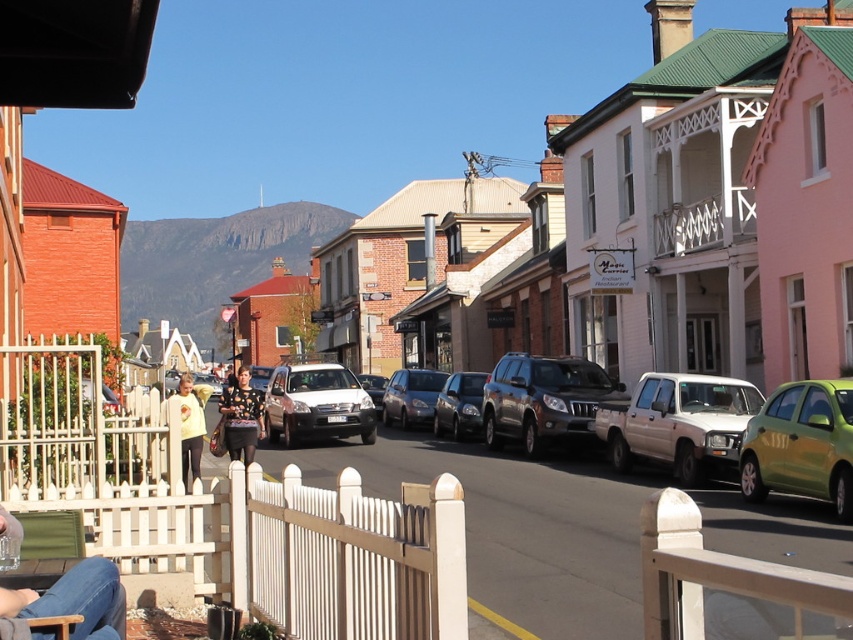
Between white matte truck at center and yellow matte shirt at lower left, which one appears on the left side from the viewer's perspective?

Positioned to the left is yellow matte shirt at lower left.

Can you confirm if white matte truck at center is positioned below yellow matte shirt at lower left?

No.

Describe the element at coordinates (679, 422) in the screenshot. This screenshot has height=640, width=853. I see `white matte truck at center` at that location.

You are a GUI agent. You are given a task and a screenshot of the screen. Output one action in this format:
    pyautogui.click(x=<x>, y=<y>)
    Task: Click on the white matte truck at center
    This screenshot has height=640, width=853.
    Given the screenshot: What is the action you would take?
    pyautogui.click(x=679, y=422)

Is white matte truck at center positioned in front of floral-patterned top at center?

Yes, white matte truck at center is closer to the viewer.

Which is behind, point (674, 448) or point (230, 417)?

Point (230, 417)

At what (x,y) coordinates should I click in order to perform the action: click on white matte truck at center. Please return your answer as a coordinate pair (x, y). Looking at the image, I should click on (679, 422).

Is yellow matte shirt at lower left positioned before satin silver sedan at center?

Yes, it is in front of satin silver sedan at center.

Who is positioned more to the right, yellow matte shirt at lower left or satin silver sedan at center?

Positioned to the right is satin silver sedan at center.

Find the location of `yellow matte shirt at lower left`. yellow matte shirt at lower left is located at coordinates (190, 422).